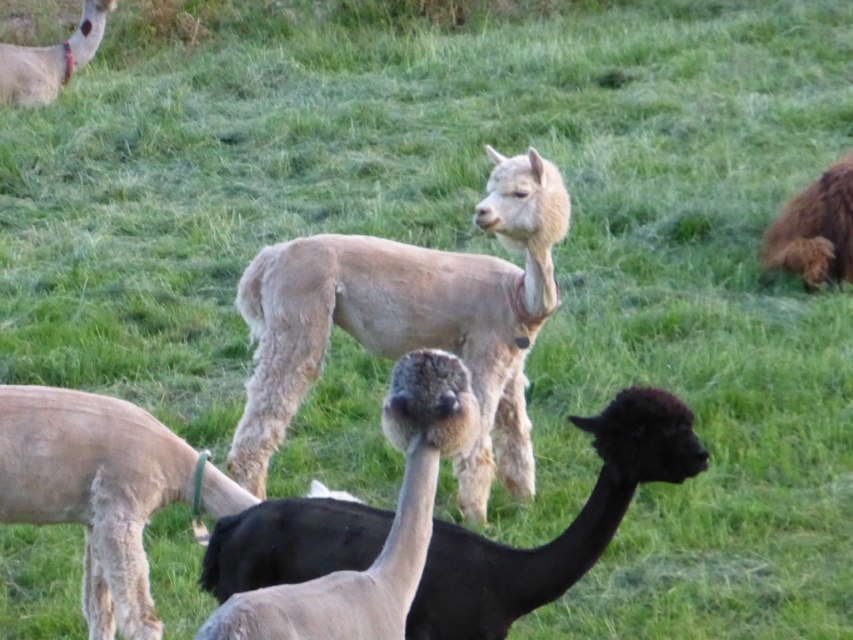
Question: Which of the following is the closest to the observer?

Choices:
 (A) [x=308, y=300]
 (B) [x=30, y=102]
 (C) [x=544, y=596]

Answer: (C)

Question: Can you confirm if light beige wool alpaca at center is wider than black woolly alpaca at center?

Choices:
 (A) no
 (B) yes

Answer: (B)

Question: Does light beige wool alpaca at center lie behind light beige wool alpaca at upper left?

Choices:
 (A) yes
 (B) no

Answer: (B)

Question: Which of the following is the farthest from the observer?

Choices:
 (A) light beige wool alpaca at center
 (B) black woolly alpaca at center

Answer: (A)

Question: Among these objects, which one is farthest from the camera?

Choices:
 (A) light beige wool alpaca at center
 (B) black woolly alpaca at center
 (C) light beige wool alpaca at upper left

Answer: (C)

Question: Is light beige wool alpaca at center closer to camera compared to black woolly alpaca at center?

Choices:
 (A) yes
 (B) no

Answer: (B)